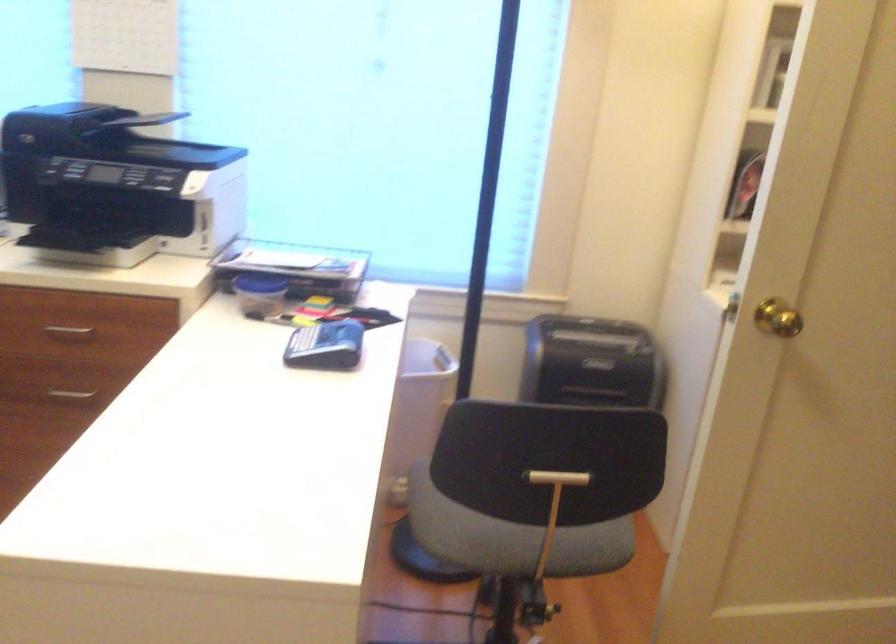
You are a GUI agent. You are given a task and a screenshot of the screen. Output one action in this format:
    pyautogui.click(x=<x>, y=<y>)
    Task: Click on the printer scanner lid
    The width and height of the screenshot is (896, 644).
    Given the screenshot: What is the action you would take?
    pyautogui.click(x=152, y=142)